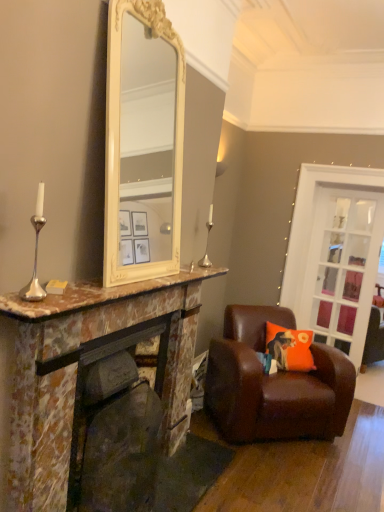
Question: Is marble fireplace at left positioned before marble fireplace at center?

Choices:
 (A) no
 (B) yes

Answer: (B)

Question: Is marble fireplace at left positioned behind marble fireplace at center?

Choices:
 (A) no
 (B) yes

Answer: (A)

Question: From the image's perspective, is marble fireplace at left beneath marble fireplace at center?

Choices:
 (A) yes
 (B) no

Answer: (B)

Question: Does marble fireplace at left appear on the left side of marble fireplace at center?

Choices:
 (A) yes
 (B) no

Answer: (A)

Question: Considering the relative sizes of marble fireplace at left and marble fireplace at center in the image provided, is marble fireplace at left thinner than marble fireplace at center?

Choices:
 (A) no
 (B) yes

Answer: (B)

Question: Is marble fireplace at left turned away from marble fireplace at center?

Choices:
 (A) yes
 (B) no

Answer: (A)

Question: Is silver/metallic candle holder at center smaller than brown leather chair at lower right?

Choices:
 (A) yes
 (B) no

Answer: (A)

Question: From the image's perspective, is silver/metallic candle holder at center above brown leather chair at lower right?

Choices:
 (A) yes
 (B) no

Answer: (A)

Question: Is silver/metallic candle holder at center positioned far away from brown leather chair at lower right?

Choices:
 (A) yes
 (B) no

Answer: (A)

Question: Is silver/metallic candle holder at center looking in the opposite direction of brown leather chair at lower right?

Choices:
 (A) yes
 (B) no

Answer: (B)

Question: Is the position of silver/metallic candle holder at center less distant than that of brown leather chair at lower right?

Choices:
 (A) no
 (B) yes

Answer: (B)

Question: Is silver/metallic candle holder at center to the left of brown leather chair at lower right from the viewer's perspective?

Choices:
 (A) yes
 (B) no

Answer: (A)

Question: Is marble fireplace at left taller than brown leather chair at lower right?

Choices:
 (A) yes
 (B) no

Answer: (A)